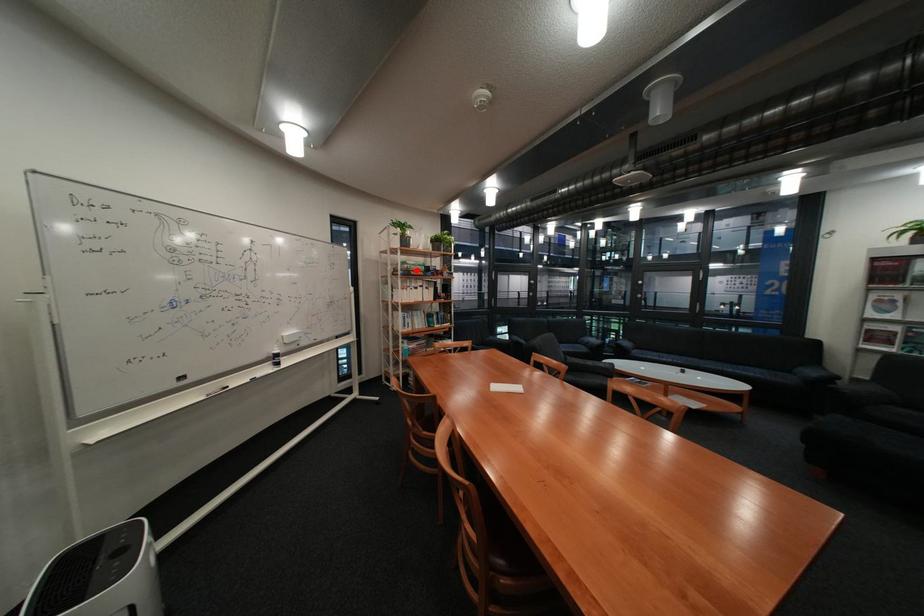
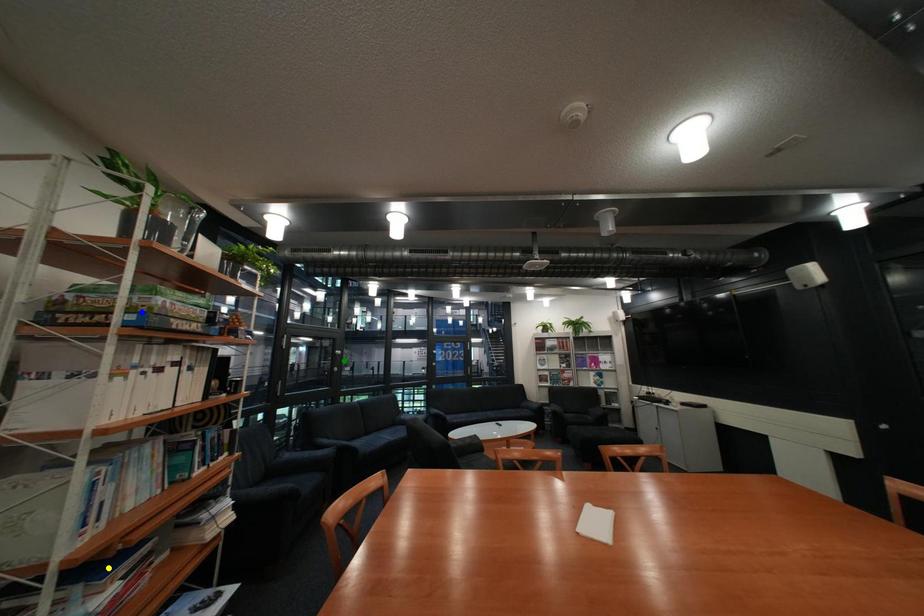
Question: I am providing you with two images of the same scene from different viewpoints. A red point is marked on the first image. You are given multiple points on the second image. Which spot in image 2 lines up with the point in image 1?

Choices:
 (A) green point
 (B) blue point
 (C) yellow point

Answer: (B)